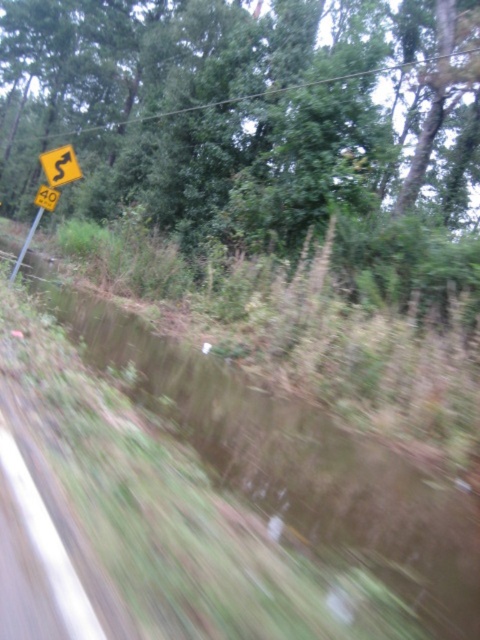
Can you confirm if brown muddy water at lower left is thinner than yellow plastic sign at upper left?

Yes, brown muddy water at lower left is thinner than yellow plastic sign at upper left.

Consider the image. Is brown muddy water at lower left taller than yellow plastic sign at upper left?

No, brown muddy water at lower left is not taller than yellow plastic sign at upper left.

Image resolution: width=480 pixels, height=640 pixels. Describe the element at coordinates (295, 460) in the screenshot. I see `brown muddy water at lower left` at that location.

Locate an element on the screen. brown muddy water at lower left is located at coordinates pyautogui.click(x=295, y=460).

Which is below, yellow plastic sign at upper left or yellow plastic road sign at upper left?

Positioned lower is yellow plastic road sign at upper left.

Is yellow plastic sign at upper left thinner than yellow plastic road sign at upper left?

Incorrect, yellow plastic sign at upper left's width is not less than yellow plastic road sign at upper left's.

Who is more forward, (57, 200) or (59, 170)?

Point (59, 170) is more forward.

Image resolution: width=480 pixels, height=640 pixels. What are the coordinates of `yellow plastic sign at upper left` in the screenshot? It's located at (x=49, y=188).

Can you confirm if brown muddy water at lower left is positioned to the right of yellow plastic road sign at upper left?

Indeed, brown muddy water at lower left is positioned on the right side of yellow plastic road sign at upper left.

Is point (210, 360) closer to viewer compared to point (44, 163)?

No, (210, 360) is behind (44, 163).

This screenshot has height=640, width=480. Find the location of `brown muddy water at lower left`. brown muddy water at lower left is located at coordinates (295, 460).